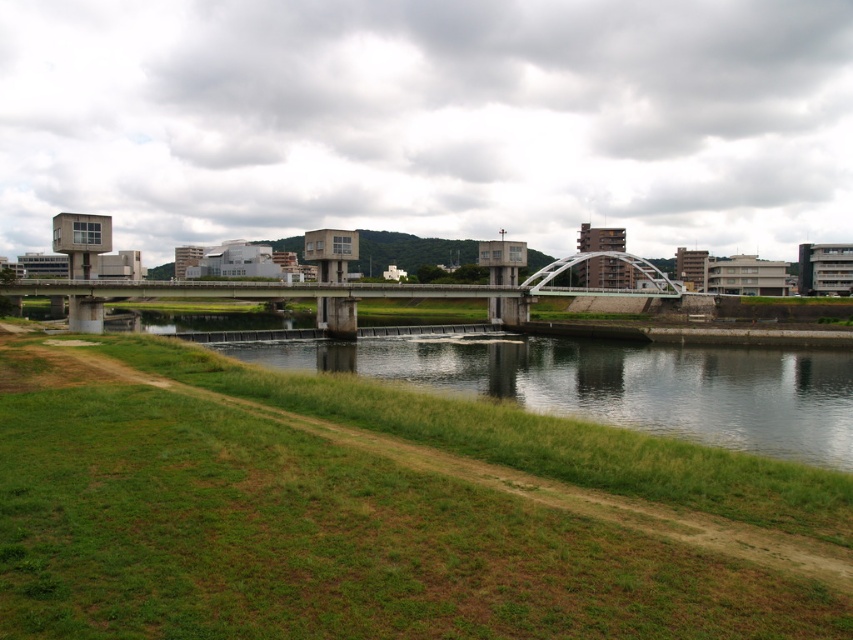
Question: Observing the image, what is the correct spatial positioning of green grassy bank at lower left in reference to concrete bridge at center?

Choices:
 (A) left
 (B) right

Answer: (B)

Question: Which point appears closest to the camera in this image?

Choices:
 (A) (349, 371)
 (B) (561, 268)

Answer: (A)

Question: Where is green grassy bank at lower left located in relation to concrete bridge at center in the image?

Choices:
 (A) left
 (B) right

Answer: (B)

Question: Which point appears closest to the camera in this image?

Choices:
 (A) (573, 260)
 (B) (489, 384)

Answer: (B)

Question: Is green grassy bank at lower left in front of concrete bridge at center?

Choices:
 (A) no
 (B) yes

Answer: (B)